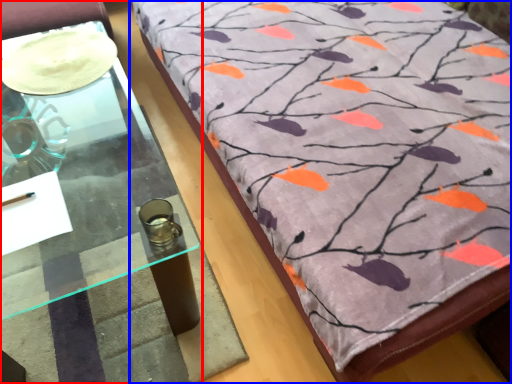
Question: Which point is closer to the camera, table (highlighted by a red box) or furniture (highlighted by a blue box)?

Choices:
 (A) table
 (B) furniture

Answer: (B)